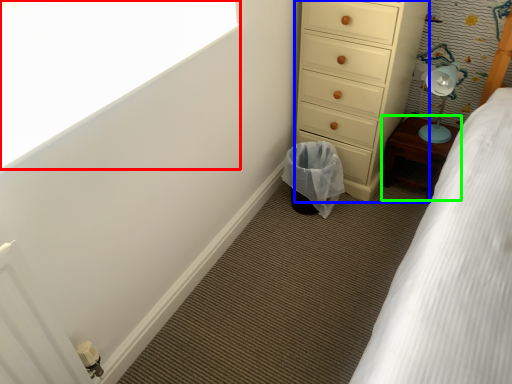
Question: Estimate the real-world distances between objects in this image. Which object is closer to window screen (highlighted by a red box), chest of drawers (highlighted by a blue box) or furniture (highlighted by a green box)?

Choices:
 (A) chest of drawers
 (B) furniture

Answer: (A)